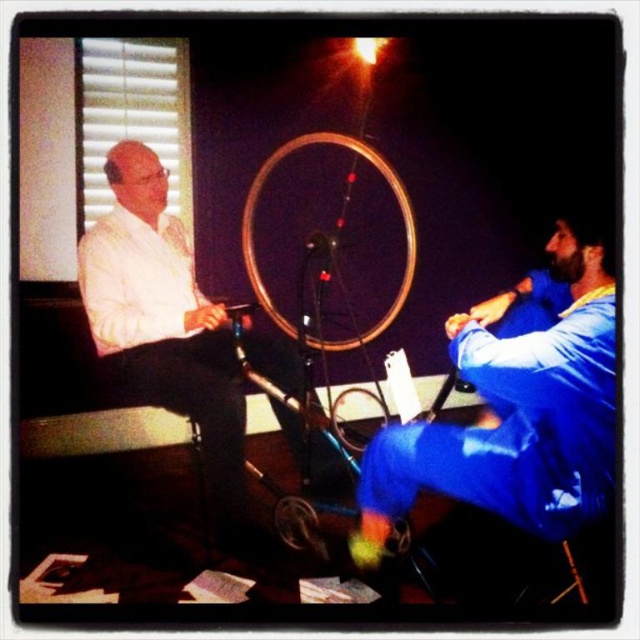
You are standing in the room and want to place a 2.1 meter long banner between you and the point at coordinates point (400, 490). Will the banner fit without touching the point?

The distance from you to the point point (400, 490) is 2.09 meters. Since the banner is 2.1 meters long, it will extend slightly beyond the point, so it can fit without touching the point as there is a 0.01 meter difference.

You are organizing a photo shoot and need to ensure that all objects in the frame are visible. Given the white matte shirt at left and the wooden bicycle wheel at center, which object might require more space in the composition to be fully captured?

The white matte shirt at left is larger in size than the wooden bicycle wheel at center, so it would require more space in the composition to be fully captured.

You are standing in the room and want to hand a document to the person in the white matte shirt at left. Based on their position at coordinates 0.498, 0.255, can you estimate if they are standing or sitting?

The white matte shirt at left is located at point (163, 317), which indicates they are standing since the coordinates suggest a higher position compared to seated individuals.